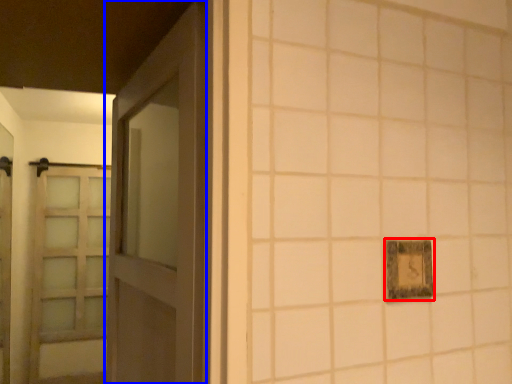
Question: Which of the following is the farthest to the observer, picture frame (highlighted by a red box) or door (highlighted by a blue box)?

Choices:
 (A) picture frame
 (B) door

Answer: (A)